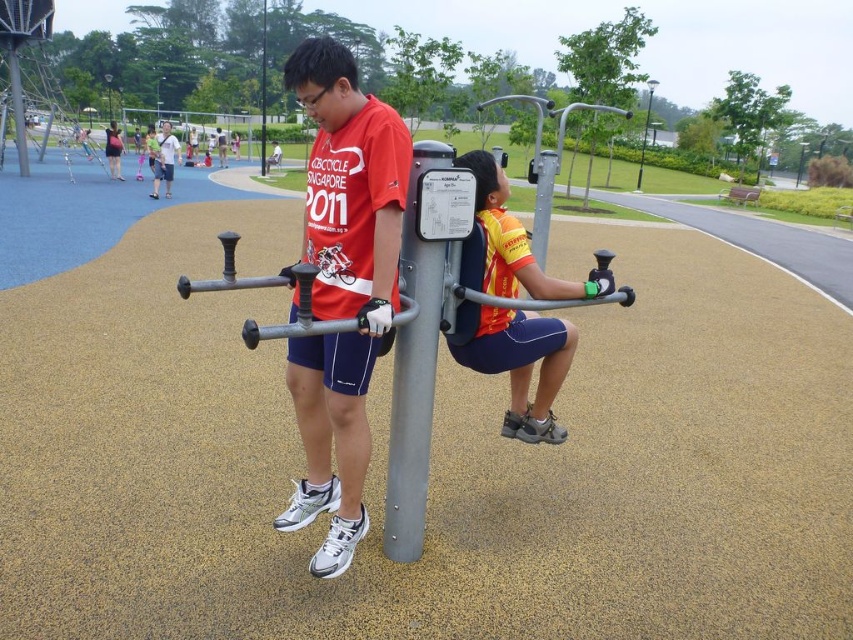
Question: Observing the image, what is the correct spatial positioning of matte red shirt at center in reference to yellow fabric vest at center?

Choices:
 (A) above
 (B) below

Answer: (B)

Question: Which object is the closest to the matte red shirt at center?

Choices:
 (A) white cotton shirt at upper left
 (B) yellow fabric vest at center

Answer: (B)

Question: In this image, where is white cotton shirt at upper left located relative to brushed metal pole at center?

Choices:
 (A) right
 (B) left

Answer: (A)

Question: Which of the following is the closest to the observer?

Choices:
 (A) (262, 60)
 (B) (474, 205)
 (C) (358, 474)

Answer: (C)

Question: Which object appears farthest from the camera in this image?

Choices:
 (A) matte red shirt at center
 (B) brushed metal pole at center
 (C) yellow fabric vest at center

Answer: (B)

Question: Does matte red shirt at center appear on the right side of white cotton shirt at upper left?

Choices:
 (A) no
 (B) yes

Answer: (B)